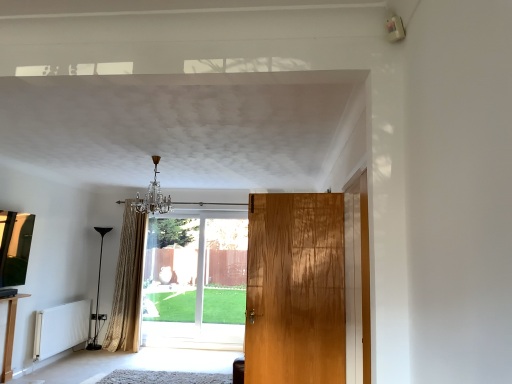
Where is `clear glass door at center, positioned as the 2th door in front-to-back order`? The height and width of the screenshot is (384, 512). clear glass door at center, positioned as the 2th door in front-to-back order is located at coordinates (195, 283).

In order to click on light brown wood table at lower left in this screenshot , I will do `click(10, 336)`.

Locate an element on the screen. gold textured curtain at center is located at coordinates (128, 284).

Where is `light brown wood door at center, the first door from the front`? This screenshot has width=512, height=384. light brown wood door at center, the first door from the front is located at coordinates (297, 288).

In the image, there is a light brown wood door at center, the 2th door viewed from the back. Identify the location of lamp below it (from the image's perspective). (98, 294).

Consider the image. Would you say black glass floor lamp at left is a long distance from light brown wood door at center, the 2th door viewed from the back?

black glass floor lamp at left is positioned a significant distance from light brown wood door at center, the 2th door viewed from the back.

Does point (97, 285) lie behind point (282, 355)?

Yes, it is behind point (282, 355).

Considering the relative sizes of black glass floor lamp at left and light brown wood door at center, the first door in the right-to-left sequence, in the image provided, is black glass floor lamp at left wider than light brown wood door at center, the first door in the right-to-left sequence,?

Yes, black glass floor lamp at left is wider than light brown wood door at center, the first door in the right-to-left sequence.

From the image's perspective, which one is positioned higher, crystal glass chandelier at upper center or light brown wood door at center, the 2th door when ordered from left to right?

crystal glass chandelier at upper center.

Choose the correct answer: Is crystal glass chandelier at upper center inside light brown wood door at center, the 2th door viewed from the back, or outside it?

crystal glass chandelier at upper center cannot be found inside light brown wood door at center, the 2th door viewed from the back.

Considering the positions of objects crystal glass chandelier at upper center and light brown wood door at center, the first door in the right-to-left sequence, in the image provided, who is in front, crystal glass chandelier at upper center or light brown wood door at center, the first door in the right-to-left sequence,?

light brown wood door at center, the first door in the right-to-left sequence.

Considering the relative positions of gold textured curtain at center and light brown wood door at center, the 2th door viewed from the back, in the image provided, is gold textured curtain at center to the left of light brown wood door at center, the 2th door viewed from the back, from the viewer's perspective?

Yes.

From a real-world perspective, does gold textured curtain at center sit lower than light brown wood door at center, the 2th door viewed from the back?

Yes, from a real-world perspective, gold textured curtain at center is below light brown wood door at center, the 2th door viewed from the back.

Looking at this image, from the image's perspective, which object appears higher, gold textured curtain at center or light brown wood door at center, the first door from the front?

light brown wood door at center, the first door from the front, appears higher in the image.

This screenshot has width=512, height=384. Find the location of `door that appears above the gold textured curtain at center (from the image's perspective)`. door that appears above the gold textured curtain at center (from the image's perspective) is located at coordinates (297, 288).

Which is more to the left, clear glass door at center, which ranks as the first door in left-to-right order, or gold textured curtain at center?

Positioned to the left is gold textured curtain at center.

Between clear glass door at center, marked as the second door in a right-to-left arrangement, and gold textured curtain at center, which one has less height?

Standing shorter between the two is clear glass door at center, marked as the second door in a right-to-left arrangement.

How different are the orientations of clear glass door at center, arranged as the 1th door when viewed from the back, and gold textured curtain at center in degrees?

The angular difference between clear glass door at center, arranged as the 1th door when viewed from the back, and gold textured curtain at center is 1.38 degrees.

Considering the relative sizes of clear glass door at center, marked as the second door in a right-to-left arrangement, and gold textured curtain at center in the image provided, is clear glass door at center, marked as the second door in a right-to-left arrangement, thinner than gold textured curtain at center?

Yes.

From the picture: Is gold textured curtain at center far from light brown wood table at lower left?

gold textured curtain at center is far away from light brown wood table at lower left.

From the image's perspective, is gold textured curtain at center over light brown wood table at lower left?

Indeed, from the image's perspective, gold textured curtain at center is shown above light brown wood table at lower left.

Is point (129, 294) positioned after point (1, 381)?

Yes, it is behind point (1, 381).

Which of these two, clear glass door at center, positioned as the 2th door in front-to-back order, or light brown wood table at lower left, is wider?

With larger width is light brown wood table at lower left.

Is clear glass door at center, which ranks as the first door in left-to-right order, to the right of light brown wood table at lower left from the viewer's perspective?

Yes.

Is clear glass door at center, which ranks as the first door in left-to-right order, oriented away from light brown wood table at lower left?

clear glass door at center, which ranks as the first door in left-to-right order, is not turned away from light brown wood table at lower left.

Which of these two, crystal glass chandelier at upper center or light brown wood table at lower left, is bigger?

With larger size is crystal glass chandelier at upper center.

Is light brown wood table at lower left located within crystal glass chandelier at upper center?

No.

Considering the positions of objects crystal glass chandelier at upper center and light brown wood table at lower left in the image provided, who is more to the right, crystal glass chandelier at upper center or light brown wood table at lower left?

Positioned to the right is crystal glass chandelier at upper center.

Is point (152, 195) less distant than point (25, 296)?

No, (152, 195) is behind (25, 296).

Image resolution: width=512 pixels, height=384 pixels. Identify the location of lamp directly beneath the light brown wood door at center, the 2th door when ordered from left to right (from a real-world perspective). (98, 294).

At what (x,y) coordinates should I click in order to perform the action: click on light fixture above the light brown wood door at center, the first door in the right-to-left sequence (from the image's perspective). Please return your answer as a coordinate pair (x, y). Looking at the image, I should click on (153, 196).

Considering their positions, is clear glass door at center, arranged as the 1th door when viewed from the back, positioned closer to light brown wood table at lower left than crystal glass chandelier at upper center?

crystal glass chandelier at upper center is positioned closer to the anchor light brown wood table at lower left.

Looking at the image, which one is located closer to white matte radiator at lower left, black glass floor lamp at left or gold textured curtain at center?

Based on the image, black glass floor lamp at left appears to be nearer to white matte radiator at lower left.

Which object lies nearer to the anchor point light brown wood door at center, the first door in the right-to-left sequence, crystal glass chandelier at upper center or black glass floor lamp at left?

Among the two, crystal glass chandelier at upper center is located nearer to light brown wood door at center, the first door in the right-to-left sequence.

Considering their positions, is light brown wood table at lower left positioned closer to gold textured curtain at center than crystal glass chandelier at upper center?

Based on the image, crystal glass chandelier at upper center appears to be nearer to gold textured curtain at center.

Which object lies nearer to the anchor point clear glass door at center, arranged as the 1th door when viewed from the back, black glass floor lamp at left or light brown wood table at lower left?

black glass floor lamp at left.

Looking at the image, which one is located closer to gold textured curtain at center, light brown wood table at lower left or black glass floor lamp at left?

black glass floor lamp at left is positioned closer to the anchor gold textured curtain at center.

Considering their positions, is gold textured curtain at center positioned closer to light brown wood door at center, the 2th door viewed from the back, than crystal glass chandelier at upper center?

Based on the image, crystal glass chandelier at upper center appears to be nearer to light brown wood door at center, the 2th door viewed from the back.

From the image, which object appears to be nearer to black glass floor lamp at left, clear glass door at center, positioned as the 2th door in front-to-back order, or white matte radiator at lower left?

white matte radiator at lower left.

Where is `lamp between light brown wood table at lower left and clear glass door at center, arranged as the 1th door when viewed from the back, from front to back`? The height and width of the screenshot is (384, 512). lamp between light brown wood table at lower left and clear glass door at center, arranged as the 1th door when viewed from the back, from front to back is located at coordinates (98, 294).

Find the location of a particular element. radiator between light brown wood door at center, the 2th door when ordered from left to right, and gold textured curtain at center in the front-back direction is located at coordinates (61, 328).

Find the location of a particular element. The width and height of the screenshot is (512, 384). lamp between light brown wood door at center, the first door from the front, and clear glass door at center, positioned as the 2th door in front-to-back order, from front to back is located at coordinates (98, 294).

Find the location of a particular element. The image size is (512, 384). curtain between crystal glass chandelier at upper center and clear glass door at center, which ranks as the first door in left-to-right order, in the front-back direction is located at coordinates (128, 284).